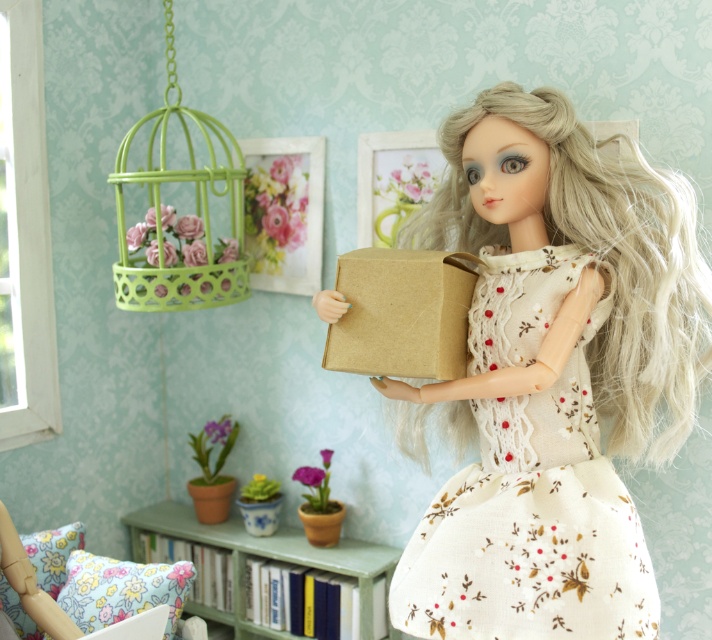
You are a decorator planning to place a new decorative item in the miniature room. The item is the size of the matte brown pot at lower center. You want to place it near the green painted wood bookshelf at lower center. Will the space be sufficient?

The green painted wood bookshelf at lower center is bigger than the matte brown pot at lower center, so there should be enough space to place the new item near it.

You are organizing a small shelf in the dollhouse and need to place both the green painted wood bookshelf at lower center and the matte brown pot at lower center. Which object should you place first if you want to ensure there is enough space for both?

The green painted wood bookshelf at lower center should be placed first because it is wider than the matte brown pot at lower center. This ensures there is enough space left for the smaller pot afterward.

You are organizing a small picnic basket and need to choose between the matte brown paper bag at center and the green wire birdcage at upper left. Which item has a greater width?

The matte brown paper bag at center has a greater width than the green wire birdcage at upper left.